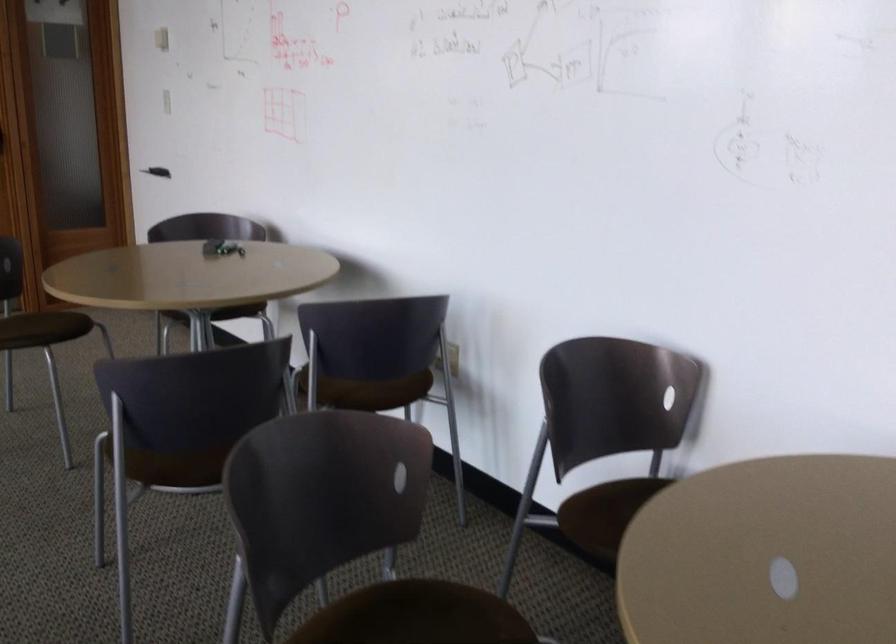
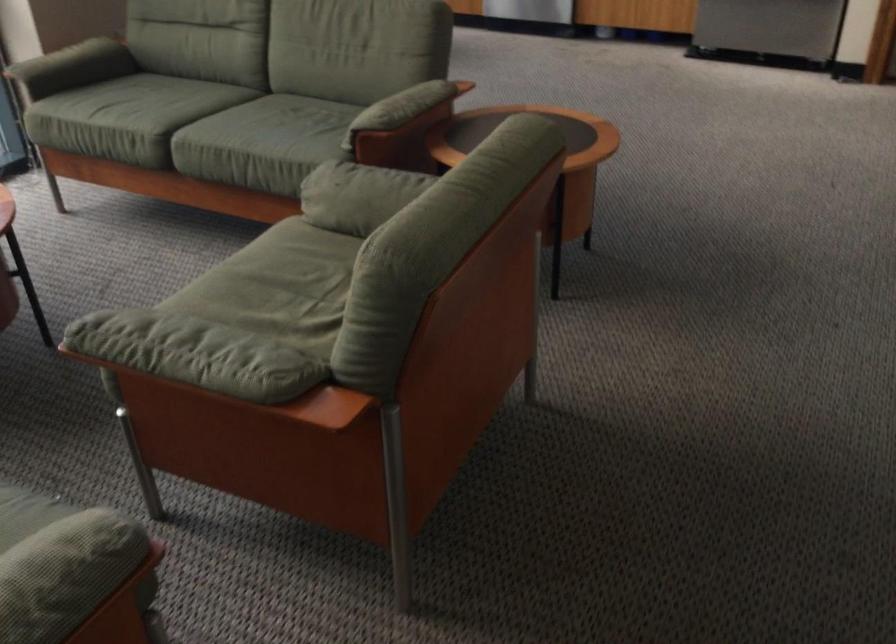
The images are taken continuously from a first-person perspective. In which direction is your viewpoint rotating?

The camera rotated toward left-down.